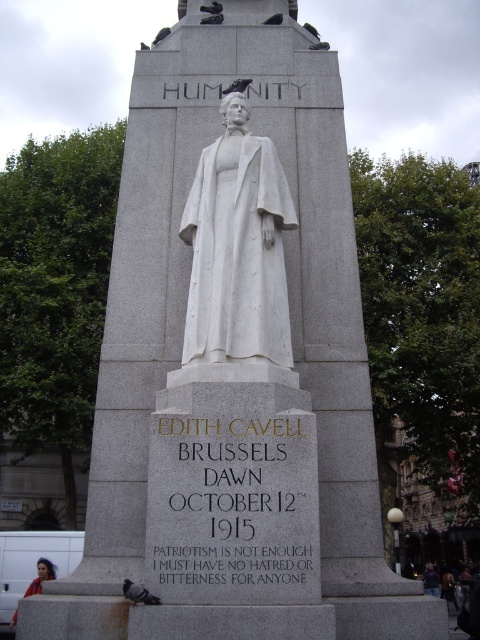
Question: Can you confirm if gray feathered pigeon at upper center is thinner than gray matte pigeon at upper center?

Choices:
 (A) no
 (B) yes

Answer: (B)

Question: Which object appears farthest from the camera in this image?

Choices:
 (A) gray feathered pigeon at upper center
 (B) gray matte pigeon at upper center
 (C) red jacket at lower left
 (D) gray feathered pigeon at lower left

Answer: (C)

Question: Is red jacket at lower left bigger than gray feathered pigeon at upper center?

Choices:
 (A) no
 (B) yes

Answer: (B)

Question: Observing the image, what is the correct spatial positioning of red jacket at lower left in reference to gray feathered pigeon at upper center?

Choices:
 (A) above
 (B) below

Answer: (B)

Question: Among these objects, which one is nearest to the camera?

Choices:
 (A) gray matte pigeon at upper center
 (B) red jacket at lower left

Answer: (A)

Question: Which is nearer to the gray feathered pigeon at upper center?

Choices:
 (A) gray matte pigeon at upper center
 (B) white marble statue at center

Answer: (A)